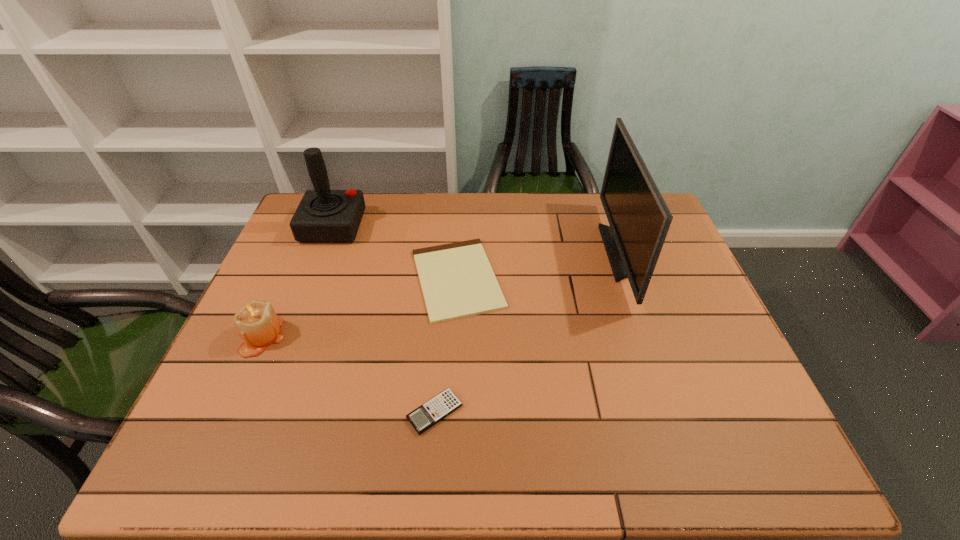
Image resolution: width=960 pixels, height=540 pixels. Identify the location of free space between the clipboard and the monitor. (540, 266).

Locate an element on the screen. The image size is (960, 540). free space between the third shortest object and the second shortest object is located at coordinates (348, 374).

Identify the location of vacant space that's between the shortest object and the calculator. (446, 345).

You are a GUI agent. You are given a task and a screenshot of the screen. Output one action in this format:
    pyautogui.click(x=<x>, y=<y>)
    Task: Click on the empty location between the shortest object and the monitor
    
    Given the screenshot: What is the action you would take?
    pyautogui.click(x=540, y=266)

Identify which object is the fourth closest to the fourth shortest object. Please provide its 2D coordinates. Your answer should be formatted as a tuple, i.e. [(x, y)], where the tuple contains the x and y coordinates of a point satisfying the conditions above.

[(639, 218)]

Identify which object is located as the third nearest to the monitor. Please provide its 2D coordinates. Your answer should be formatted as a tuple, i.e. [(x, y)], where the tuple contains the x and y coordinates of a point satisfying the conditions above.

[(323, 216)]

At what (x,y) coordinates should I click in order to perform the action: click on free location that satisfies the following two spatial constraints: 1. on the back side of the nearest object; 2. on the base of the second tallest object. Please return your answer as a coordinate pair (x, y). The image size is (960, 540). Looking at the image, I should click on (449, 226).

This screenshot has height=540, width=960. I want to click on vacant space that satisfies the following two spatial constraints: 1. on the back side of the nearest object; 2. on the right side of the clipboard, so click(x=445, y=279).

The image size is (960, 540). Find the location of `vacant space that satisfies the following two spatial constraints: 1. on the base of the fourth shortest object; 2. on the back side of the calculator`. vacant space that satisfies the following two spatial constraints: 1. on the base of the fourth shortest object; 2. on the back side of the calculator is located at coordinates (260, 412).

Image resolution: width=960 pixels, height=540 pixels. In order to click on free location that satisfies the following two spatial constraints: 1. on the base of the second tallest object; 2. on the left side of the shortest object in this screenshot , I will do `click(313, 279)`.